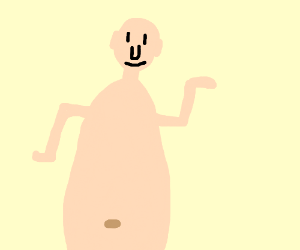
What are the coordinates of `chest` in the screenshot? It's located at (120, 125).